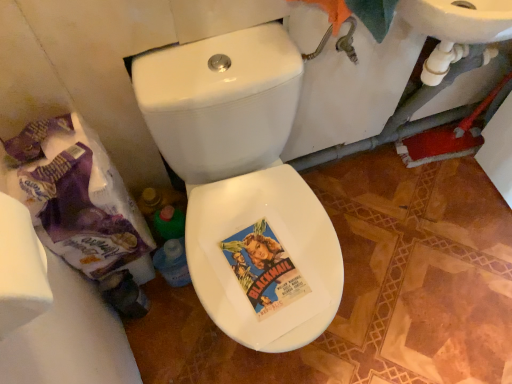
Question: Is white matte toilet paper at left further to camera compared to white glossy toilet at center?

Choices:
 (A) yes
 (B) no

Answer: (B)

Question: From a real-world perspective, is white matte toilet paper at left over white glossy toilet at center?

Choices:
 (A) yes
 (B) no

Answer: (A)

Question: From the image's perspective, does white matte toilet paper at left appear higher than white glossy toilet at center?

Choices:
 (A) yes
 (B) no

Answer: (A)

Question: Considering the relative sizes of white matte toilet paper at left and white glossy toilet at center in the image provided, is white matte toilet paper at left thinner than white glossy toilet at center?

Choices:
 (A) no
 (B) yes

Answer: (B)

Question: Is white matte toilet paper at left to the left of white glossy toilet at center from the viewer's perspective?

Choices:
 (A) no
 (B) yes

Answer: (B)

Question: Is white matte toilet paper at left taller or shorter than white glossy toilet at center?

Choices:
 (A) tall
 (B) short

Answer: (B)

Question: In terms of size, does white matte toilet paper at left appear bigger or smaller than white glossy toilet at center?

Choices:
 (A) small
 (B) big

Answer: (A)

Question: Considering the relative positions of white matte toilet paper at left and white glossy toilet at center in the image provided, is white matte toilet paper at left to the left or to the right of white glossy toilet at center?

Choices:
 (A) right
 (B) left

Answer: (B)

Question: Is point (6, 281) positioned closer to the camera than point (334, 291)?

Choices:
 (A) closer
 (B) farther

Answer: (A)

Question: Considering their positions, is white glossy bidet at center located in front of or behind white glossy toilet at center?

Choices:
 (A) behind
 (B) front

Answer: (A)

Question: In terms of width, does white glossy bidet at center look wider or thinner when compared to white glossy toilet at center?

Choices:
 (A) thin
 (B) wide

Answer: (A)

Question: From a real-world perspective, relative to white glossy toilet at center, is white glossy bidet at center vertically above or below?

Choices:
 (A) below
 (B) above

Answer: (B)

Question: Looking at the image, does white glossy bidet at center seem bigger or smaller compared to white glossy toilet at center?

Choices:
 (A) small
 (B) big

Answer: (A)

Question: From a real-world perspective, is white glossy bidet at center positioned above or below white matte toilet paper at left?

Choices:
 (A) above
 (B) below

Answer: (B)

Question: Is white glossy bidet at center inside the boundaries of white matte toilet paper at left, or outside?

Choices:
 (A) inside
 (B) outside

Answer: (B)